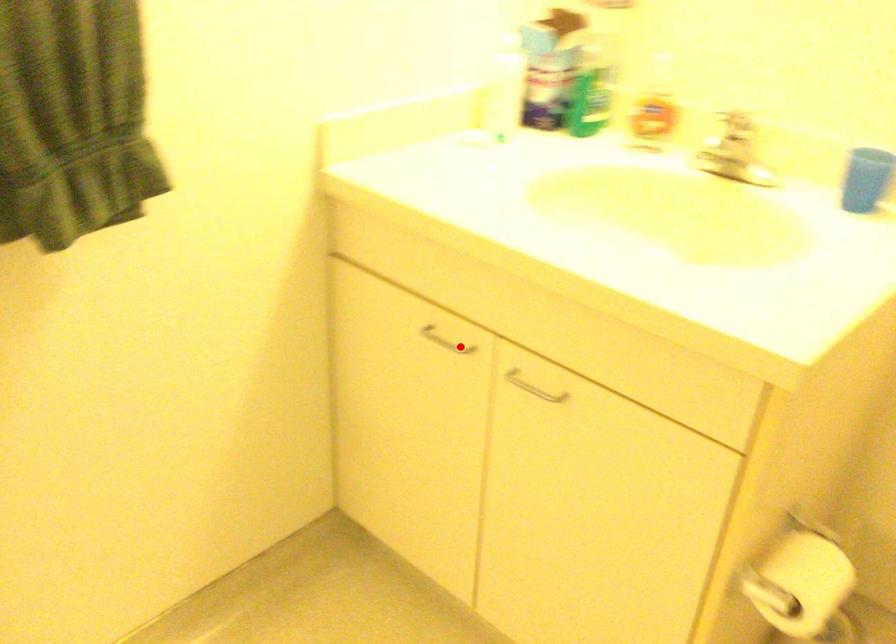
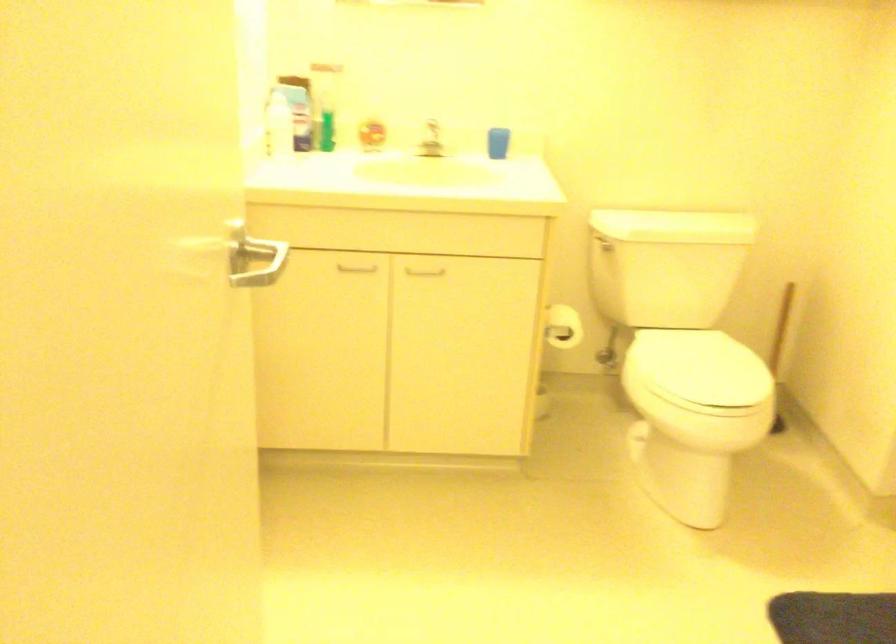
Question: A red point is marked in image1. In image2, is the corresponding 3D point closer to the camera or farther? Reply with the corresponding letter.

Choices:
 (A) The corresponding 3D point is closer.
 (B) The corresponding 3D point is farther.

Answer: (B)